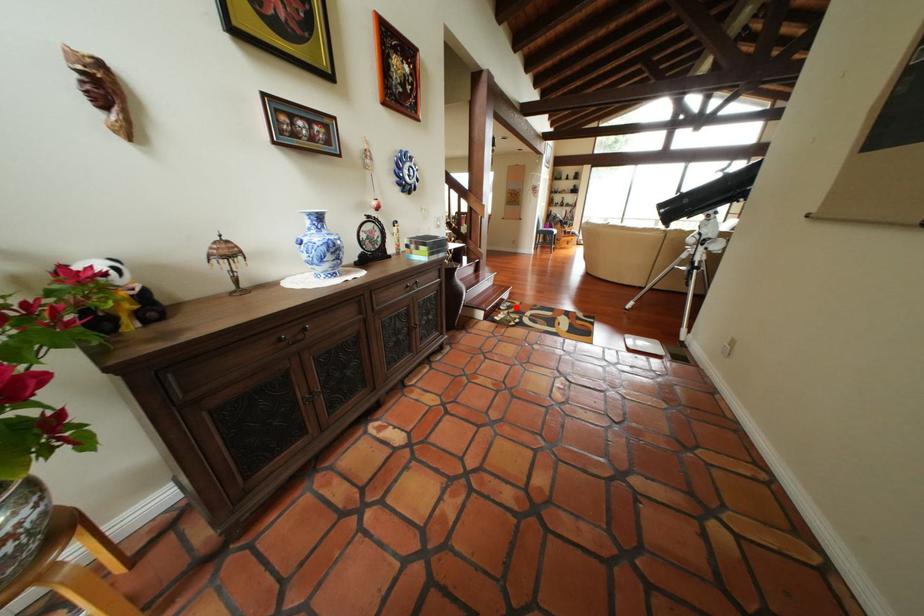
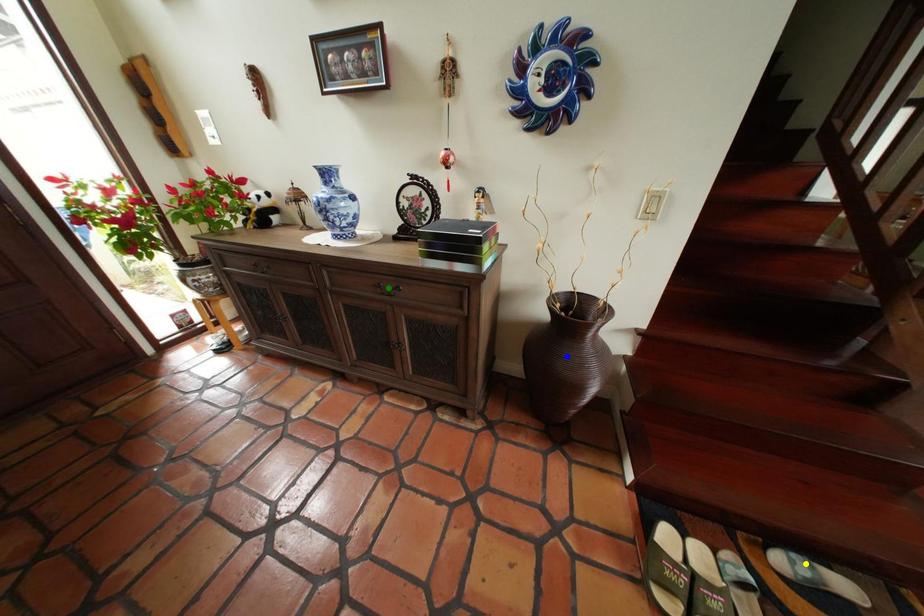
Question: I am providing you with two images of the same scene from different viewpoints. A red point is marked on the first image. You are given multiple points on the second image. Which spot in image 2 lines up with the point in image 1?

Choices:
 (A) yellow point
 (B) green point
 (C) blue point

Answer: (A)